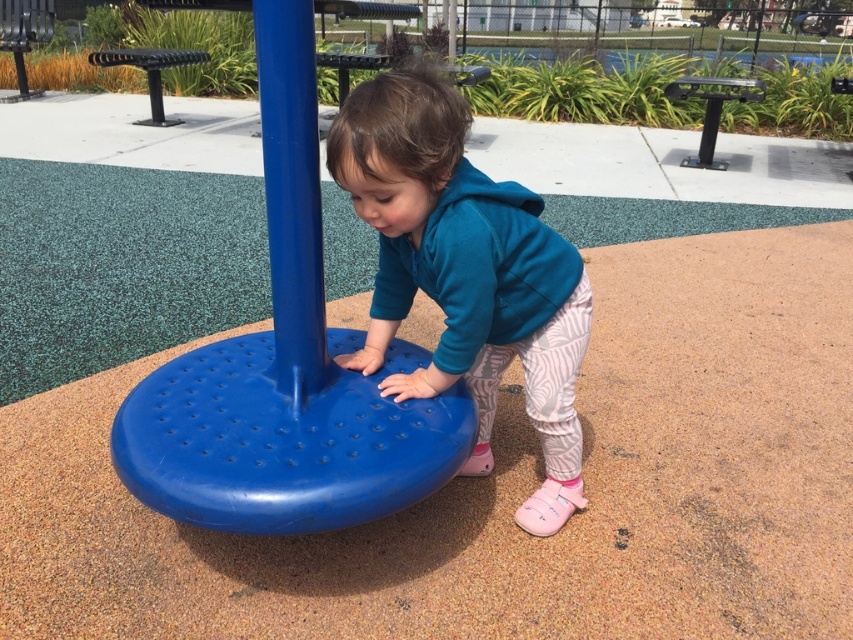
Question: Which point is closer to the camera?

Choices:
 (A) teal fleece jacket at center
 (B) blue plastic pole at center

Answer: (A)

Question: Considering the real-world distances, which object is farthest from the teal fleece jacket at center?

Choices:
 (A) blue plastic platform at center
 (B) blue plastic pole at center

Answer: (B)

Question: Considering the real-world distances, which object is closest to the blue plastic pole at center?

Choices:
 (A) teal fleece jacket at center
 (B) blue plastic platform at center

Answer: (B)

Question: Is teal fleece jacket at center closer to camera compared to blue plastic pole at center?

Choices:
 (A) yes
 (B) no

Answer: (A)

Question: Does blue plastic platform at center lie behind blue plastic pole at center?

Choices:
 (A) yes
 (B) no

Answer: (B)

Question: Can you confirm if teal fleece jacket at center is bigger than blue plastic pole at center?

Choices:
 (A) yes
 (B) no

Answer: (A)